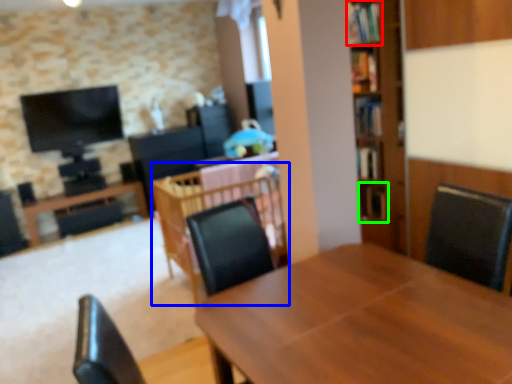
Question: Which object is positioned closest to shelf (highlighted by a red box)? Select from table (highlighted by a blue box) and shelf (highlighted by a green box).

Choices:
 (A) table
 (B) shelf

Answer: (B)